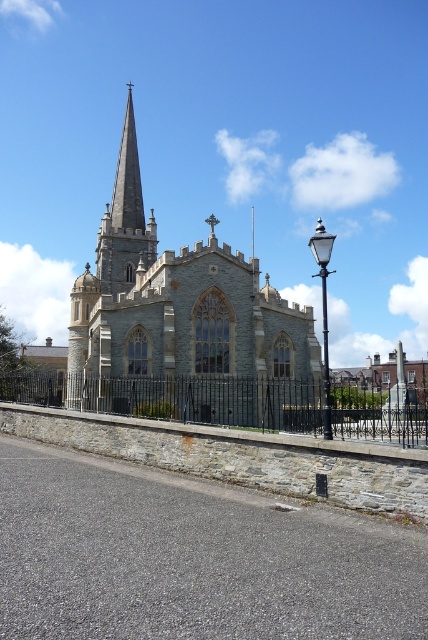
You are standing on the road looking at the gray stone church at center and the smooth gray steeple at center. Which object is positioned higher in the image?

The smooth gray steeple at center is positioned higher than the gray stone church at center in the image.

Based on the photo, you are a photographer planning to capture the gray stone church at center and the black wrought iron fence at center in a single shot. Considering their heights, which object will appear taller in your photograph?

The gray stone church at center will appear taller in the photograph because it has a greater height compared to the black wrought iron fence at center.

You are standing at the center of a square in front of the gray stone church at center. If you walk straight ahead, will you reach the church entrance?

Yes, because the gray stone church at center is positioned at point 0.418 on the vertical axis, which means it is directly ahead in the center of your view.